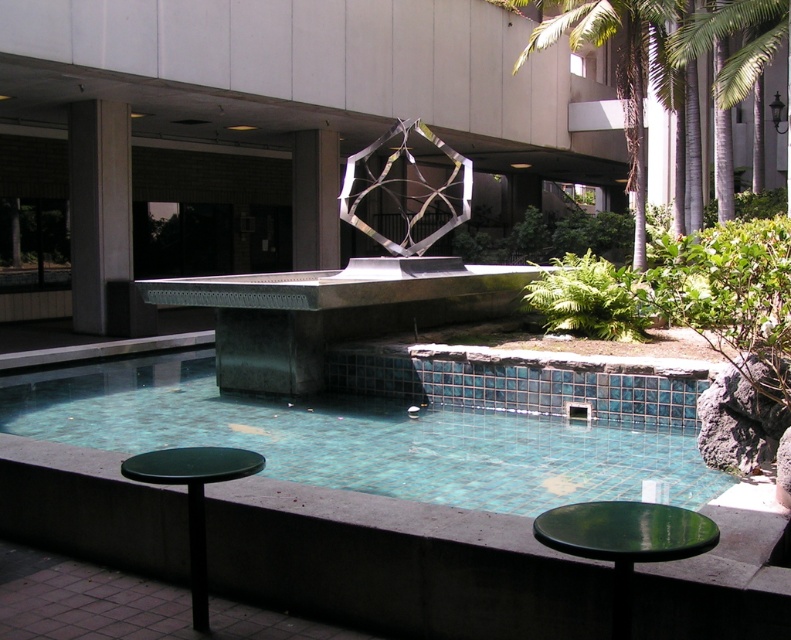
Which of these two, dark gray concrete pillar at left or green plastic table at lower left, stands taller?

With more height is dark gray concrete pillar at left.

Who is positioned more to the right, dark gray concrete pillar at left or green plastic table at lower left?

green plastic table at lower left is more to the right.

The image size is (791, 640). Identify the location of dark gray concrete pillar at left. (101, 218).

Measure the distance between teal tile swimming pool at center and camera.

5.20 meters

Who is positioned more to the right, teal tile swimming pool at center or green plastic table at lower left?

Positioned to the right is teal tile swimming pool at center.

Is point (479, 442) positioned before point (203, 529)?

No, (479, 442) is behind (203, 529).

Find the location of a particular element. This screenshot has height=640, width=791. teal tile swimming pool at center is located at coordinates (381, 435).

Which of these two, metallic silver sculpture at center or green plastic table at lower left, stands taller?

Standing taller between the two is metallic silver sculpture at center.

Which is more to the left, metallic silver sculpture at center or green plastic table at lower left?

Positioned to the left is green plastic table at lower left.

Image resolution: width=791 pixels, height=640 pixels. In order to click on metallic silver sculpture at center in this screenshot , I will do `click(407, 189)`.

The image size is (791, 640). In order to click on metallic silver sculpture at center in this screenshot , I will do [407, 189].